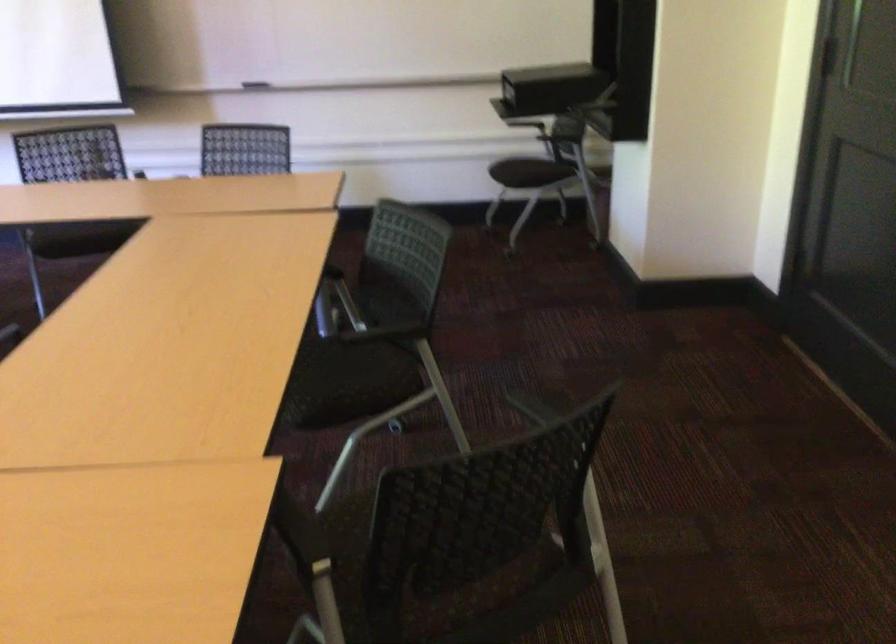
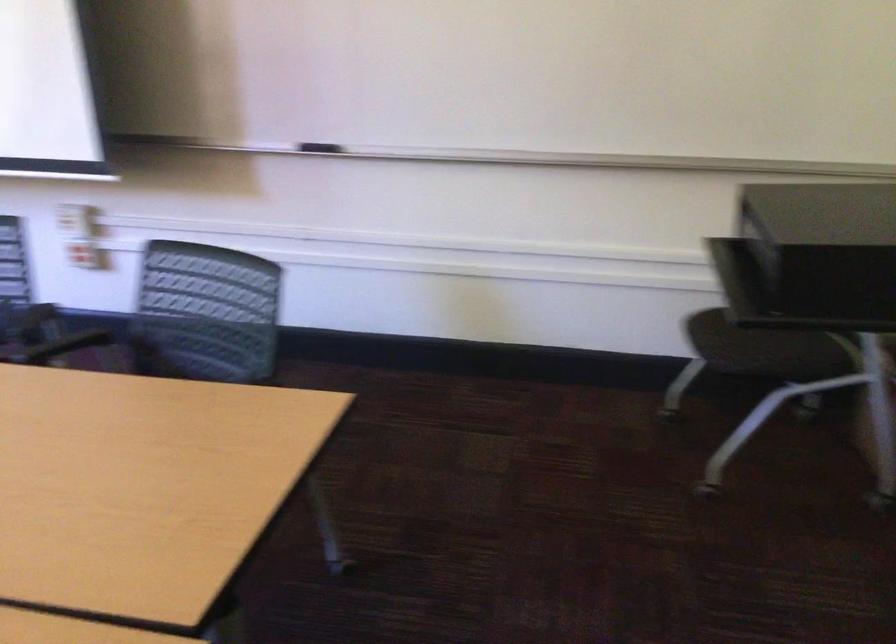
Locate, in the second image, the point that corresponds to point (250, 78) in the first image.

(319, 147)